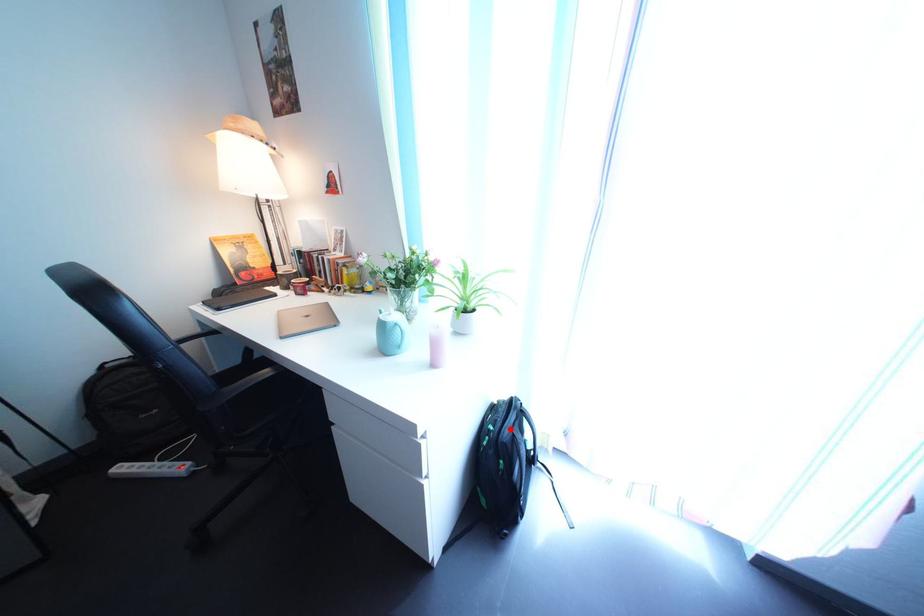
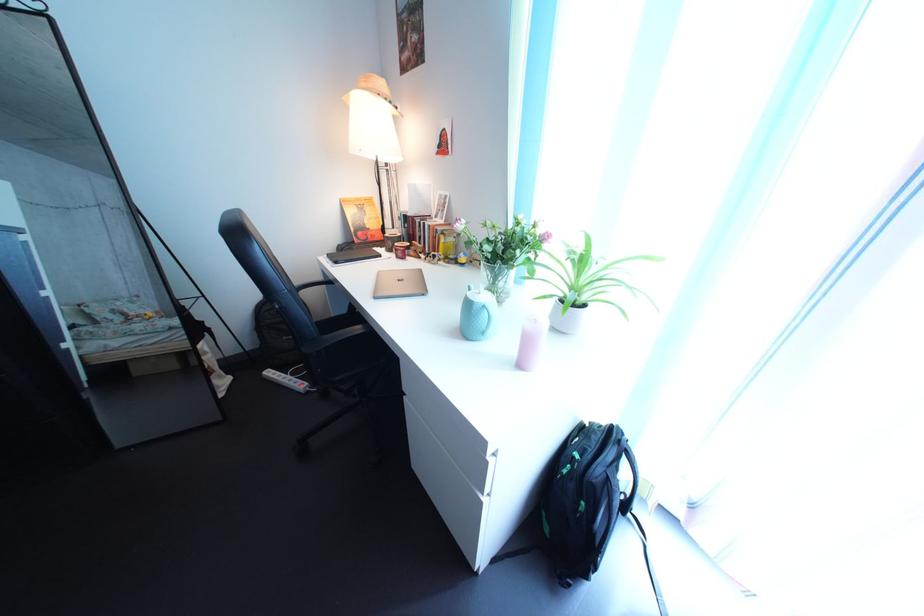
In the second image, find the point that corresponds to the highlighted location in the first image.

(600, 458)